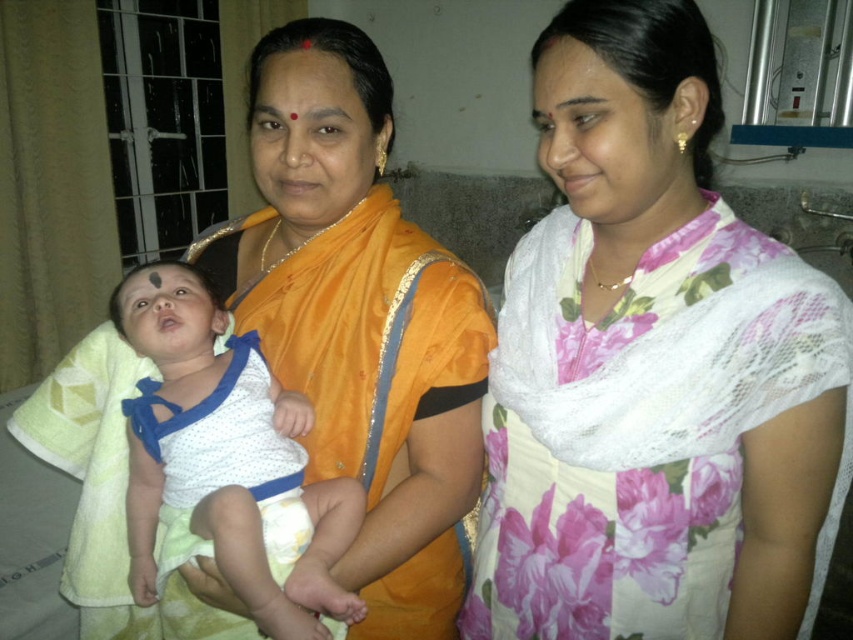
You are a photographer setting up for a family portrait. You want to ensure that the orange silk saree at center and the matte orange forehead at center are both clearly visible in the frame. Based on their positions, which object should be placed closer to the left side of the camera frame?

The orange silk saree at center is positioned on the left side of matte orange forehead at center, so to have both objects clearly visible, the orange silk saree at center should be placed closer to the left side of the camera frame.

You are a photographer trying to capture a closeup shot of the orange silk saree at center and the matte orange forehead at center in the image. Can you fit both objects into your camera frame if your camera has a minimum distance requirement of 12 inches between the two closest points of the objects?

The orange silk saree at center is 12.21 inches from the matte orange forehead at center. Since the distance between them is slightly more than 12 inches, you can fit both objects into your camera frame.

You are a photographer standing in front of the scene. You want to take a photo where both the white floral saree at center and the matte orange forehead at center are clearly visible. Which object should you focus on first to ensure both are in focus?

You should focus on the white floral saree at center first because it is closer to the viewer than the matte orange forehead at center. By focusing on the closer object, the farther one will also be in focus due to the depth of field.